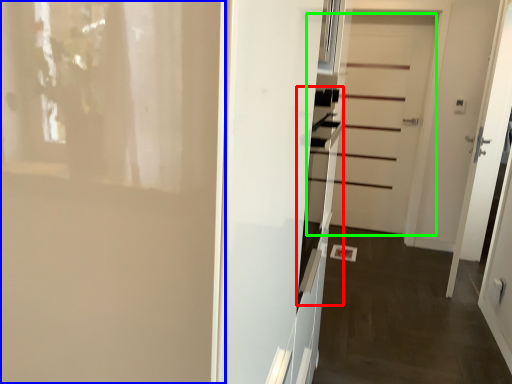
Question: Which object is positioned closest to oven (highlighted by a red box)? Select from door (highlighted by a blue box) and door (highlighted by a green box).

Choices:
 (A) door
 (B) door

Answer: (A)